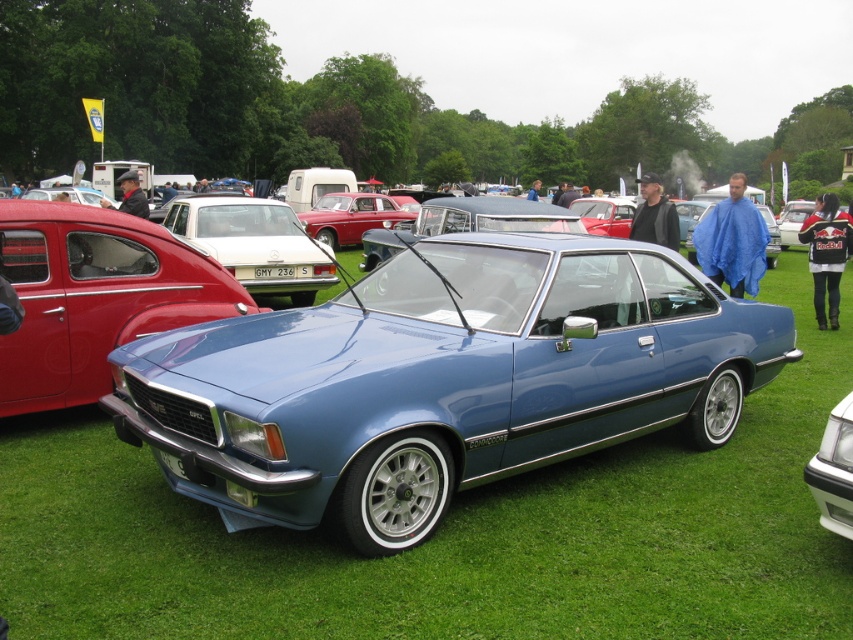
Can you confirm if matte red sedan at left is shorter than metallic silver coupe at center?

Correct, matte red sedan at left is not as tall as metallic silver coupe at center.

Is matte red sedan at left thinner than metallic silver coupe at center?

Yes, matte red sedan at left is thinner than metallic silver coupe at center.

Describe the element at coordinates (94, 296) in the screenshot. I see `matte red sedan at left` at that location.

The width and height of the screenshot is (853, 640). I want to click on matte red sedan at left, so click(x=94, y=296).

Between point (206, 250) and point (344, 196), which one is positioned behind?

The point (344, 196) is more distant.

Between point (312, 262) and point (331, 221), which one is positioned in front?

Positioned in front is point (312, 262).

Identify the location of metallic silver coupe at center. (254, 243).

Who is lower down, green grass at center or matte red sedan at left?

Positioned lower is green grass at center.

Is green grass at center smaller than matte red sedan at left?

Incorrect, green grass at center is not smaller in size than matte red sedan at left.

This screenshot has height=640, width=853. What do you see at coordinates (451, 536) in the screenshot? I see `green grass at center` at bounding box center [451, 536].

Identify the location of green grass at center. (451, 536).